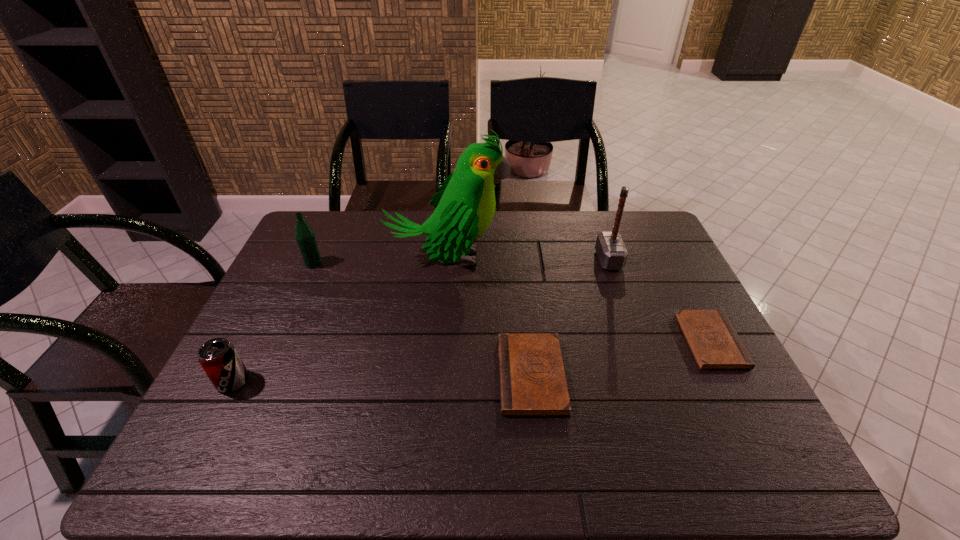
This screenshot has width=960, height=540. In order to click on free point that keeps the diarys evenly spaced on the left in this screenshot , I will do `click(322, 416)`.